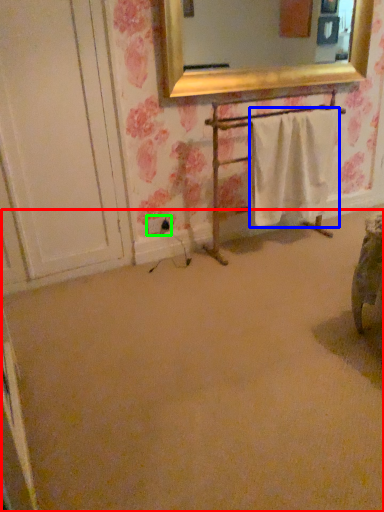
Question: Based on their relative distances, which object is farther from plain (highlighted by a red box)? Choose from bath towel (highlighted by a blue box) and electric outlet (highlighted by a green box).

Choices:
 (A) bath towel
 (B) electric outlet

Answer: (B)